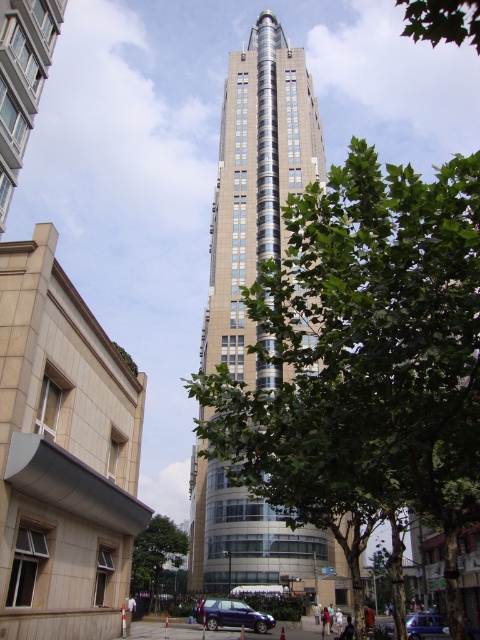
Can you confirm if green leafy tree at center is smaller than metallic blue suv at lower center?

No, green leafy tree at center is not smaller than metallic blue suv at lower center.

Is green leafy tree at center bigger than metallic blue suv at lower center?

Yes, green leafy tree at center is bigger than metallic blue suv at lower center.

The height and width of the screenshot is (640, 480). Find the location of `green leafy tree at center`. green leafy tree at center is located at coordinates (364, 360).

Identify the location of green leafy tree at center. Image resolution: width=480 pixels, height=640 pixels. (364, 360).

Does green leafy tree at upper right have a greater width compared to metallic blue suv at lower center?

Yes.

Looking at this image, can you confirm if green leafy tree at upper right is positioned above metallic blue suv at lower center?

Indeed, green leafy tree at upper right is positioned over metallic blue suv at lower center.

I want to click on green leafy tree at upper right, so click(442, 20).

Between sleek glass skyscraper at center and metallic blue suv at lower center, which one appears on the left side from the viewer's perspective?

metallic blue suv at lower center

Between sleek glass skyscraper at center and metallic blue suv at lower center, which one is positioned higher?

Positioned higher is sleek glass skyscraper at center.

Does point (250, 321) lie in front of point (227, 612)?

No, (250, 321) is behind (227, 612).

The height and width of the screenshot is (640, 480). Find the location of `sleek glass skyscraper at center`. sleek glass skyscraper at center is located at coordinates (255, 188).